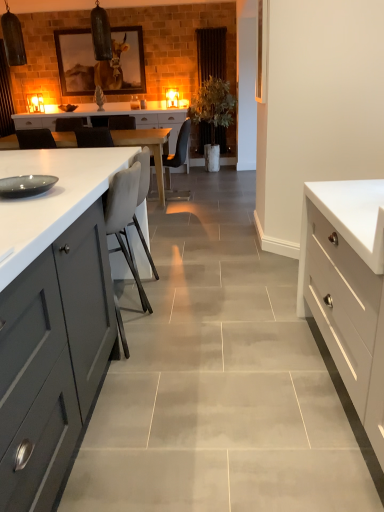
Question: Can you confirm if green leafy plant at center is positioned to the right of matte black chair at center, which is the 2th chair in front-to-back order?

Choices:
 (A) yes
 (B) no

Answer: (A)

Question: Is green leafy plant at center outside matte black chair at center, marked as the 1th chair in a top-to-bottom arrangement?

Choices:
 (A) yes
 (B) no

Answer: (A)

Question: Does green leafy plant at center come behind matte black chair at center, acting as the 2th chair starting from the bottom?

Choices:
 (A) no
 (B) yes

Answer: (B)

Question: Is green leafy plant at center turned away from matte black chair at center, which is the 2th chair in front-to-back order?

Choices:
 (A) no
 (B) yes

Answer: (A)

Question: From the image's perspective, is green leafy plant at center below matte black chair at center, the 1th chair from the back?

Choices:
 (A) yes
 (B) no

Answer: (B)

Question: Does green leafy plant at center have a larger size compared to matte black chair at center, acting as the 2th chair starting from the bottom?

Choices:
 (A) yes
 (B) no

Answer: (A)

Question: From the image's perspective, would you say wooden framed picture at upper center is shown under green leafy plant at center?

Choices:
 (A) no
 (B) yes

Answer: (A)

Question: Would you consider wooden framed picture at upper center to be distant from green leafy plant at center?

Choices:
 (A) yes
 (B) no

Answer: (A)

Question: Is wooden framed picture at upper center thinner than green leafy plant at center?

Choices:
 (A) yes
 (B) no

Answer: (A)

Question: Considering the relative positions of wooden framed picture at upper center and green leafy plant at center in the image provided, is wooden framed picture at upper center in front of green leafy plant at center?

Choices:
 (A) yes
 (B) no

Answer: (B)

Question: From a real-world perspective, is wooden framed picture at upper center on top of green leafy plant at center?

Choices:
 (A) yes
 (B) no

Answer: (A)

Question: From a real-world perspective, is wooden framed picture at upper center under green leafy plant at center?

Choices:
 (A) yes
 (B) no

Answer: (B)

Question: Considering the relative positions of white glossy drawer at right and green leafy plant at center in the image provided, is white glossy drawer at right behind green leafy plant at center?

Choices:
 (A) no
 (B) yes

Answer: (A)